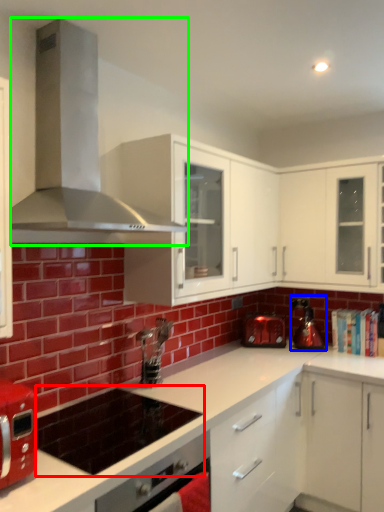
Question: Based on their relative distances, which object is nearer to appliance (highlighted by a red box)? Choose from kitchen appliance (highlighted by a blue box) and home appliance (highlighted by a green box).

Choices:
 (A) kitchen appliance
 (B) home appliance

Answer: (B)